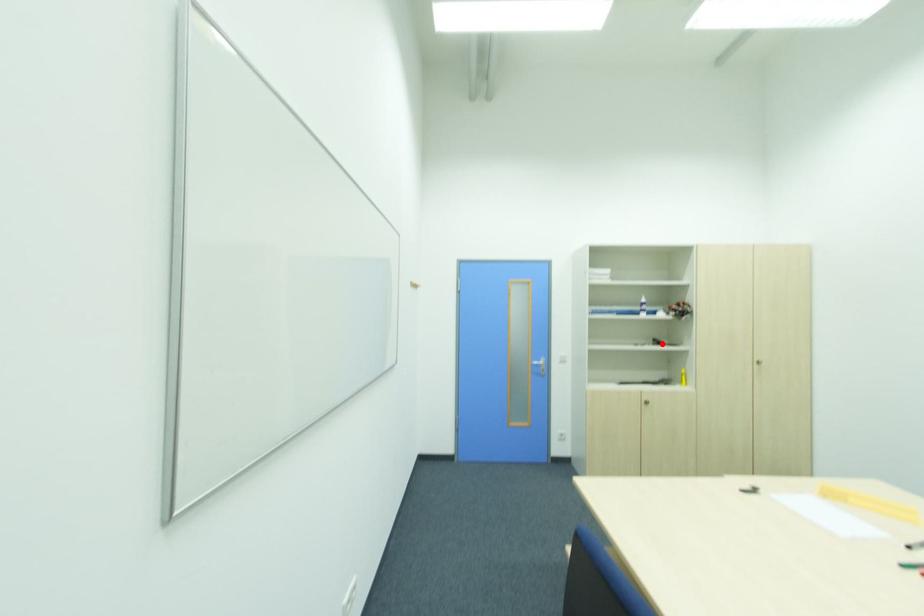
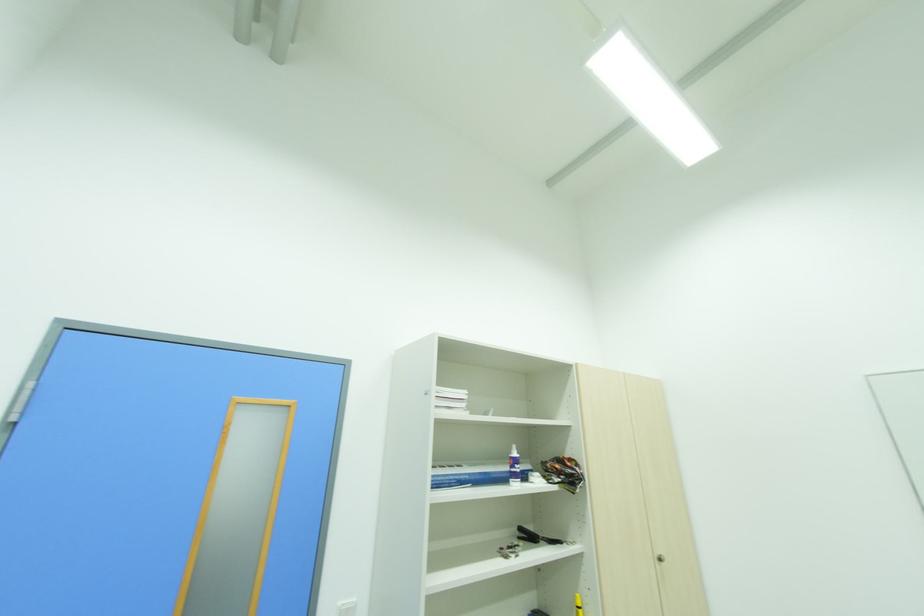
In the second image, find the point that corresponds to the highlighted location in the first image.

(536, 539)